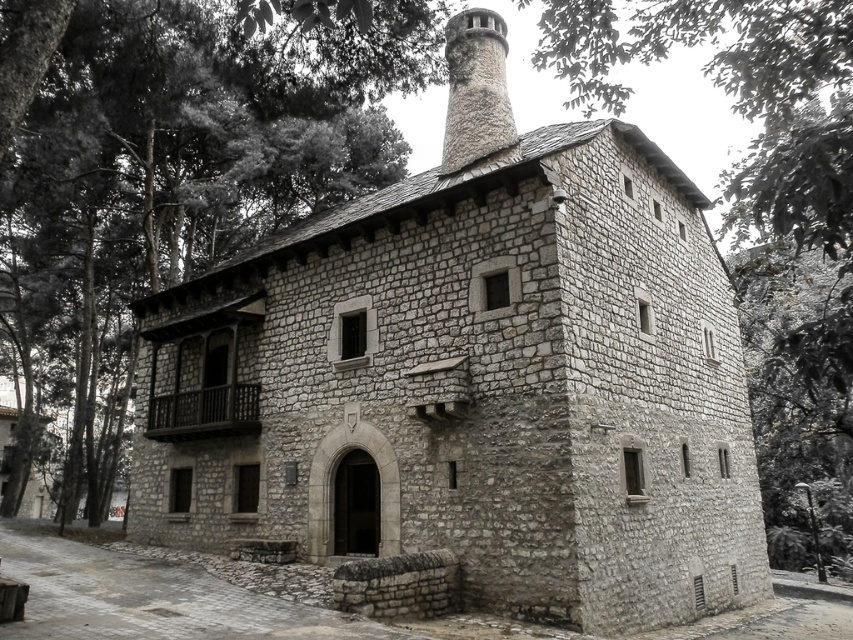
Describe the element at coordinates (181, 164) in the screenshot. I see `green leafy tree at upper left` at that location.

Is green leafy tree at upper left shorter than rough stone chimney at upper center?

No, green leafy tree at upper left is not shorter than rough stone chimney at upper center.

Is point (167, 182) positioned behind point (448, 156)?

Yes, point (167, 182) is behind point (448, 156).

Find the location of `green leafy tree at upper left`. green leafy tree at upper left is located at coordinates (181, 164).